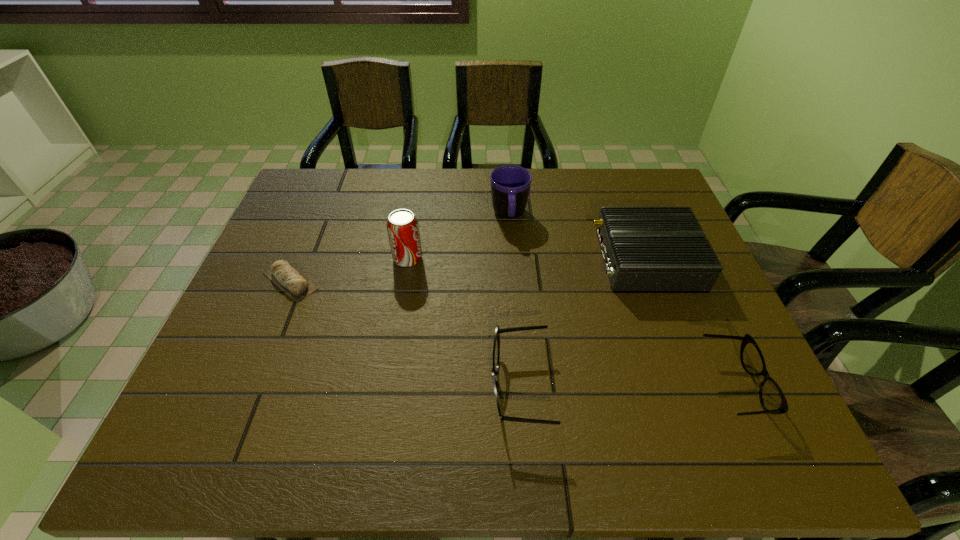
This screenshot has height=540, width=960. Identify the location of unoccupied area between the router and the pita bread. (468, 270).

I want to click on vacant area that lies between the taller spectacles and the fifth object from right to left, so click(x=464, y=323).

In order to click on vacant space in between the router and the second tallest object in this screenshot , I will do `click(578, 238)`.

Locate an element on the screen. This screenshot has height=540, width=960. vacant space that's between the soda can and the leftmost object is located at coordinates (349, 270).

I want to click on vacant point located between the leftmost object and the soda can, so [x=349, y=270].

Identify the location of vacant space that is in between the third shortest object and the mug. (515, 301).

In order to click on vacant space in between the soda can and the second shortest object in this screenshot , I will do (x=571, y=322).

You are a GUI agent. You are given a task and a screenshot of the screen. Output one action in this format:
    pyautogui.click(x=<x>, y=<y>)
    Task: Click on the blank region between the shorter spectacles and the fifth object from right to left
    Image resolution: width=960 pixels, height=540 pixels.
    Given the screenshot: What is the action you would take?
    pyautogui.click(x=571, y=322)

Where is `free space between the fifth object from right to left and the router`? The width and height of the screenshot is (960, 540). free space between the fifth object from right to left and the router is located at coordinates (527, 259).

Locate which object ranks third in proximity to the shorter spectacles. Please provide its 2D coordinates. Your answer should be formatted as a tuple, i.e. [(x, y)], where the tuple contains the x and y coordinates of a point satisfying the conditions above.

[(510, 185)]